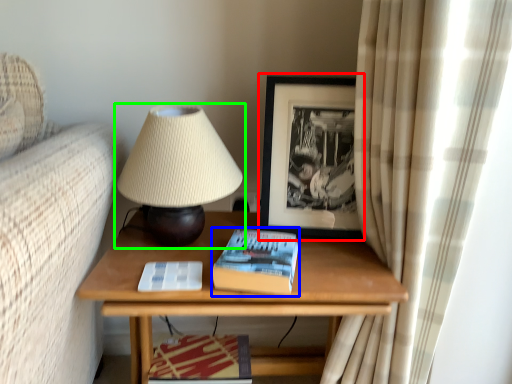
Question: Considering the real-world distances, which object is closest to picture frame (highlighted by a red box)? paperback book (highlighted by a blue box) or lamp (highlighted by a green box).

Choices:
 (A) paperback book
 (B) lamp

Answer: (B)